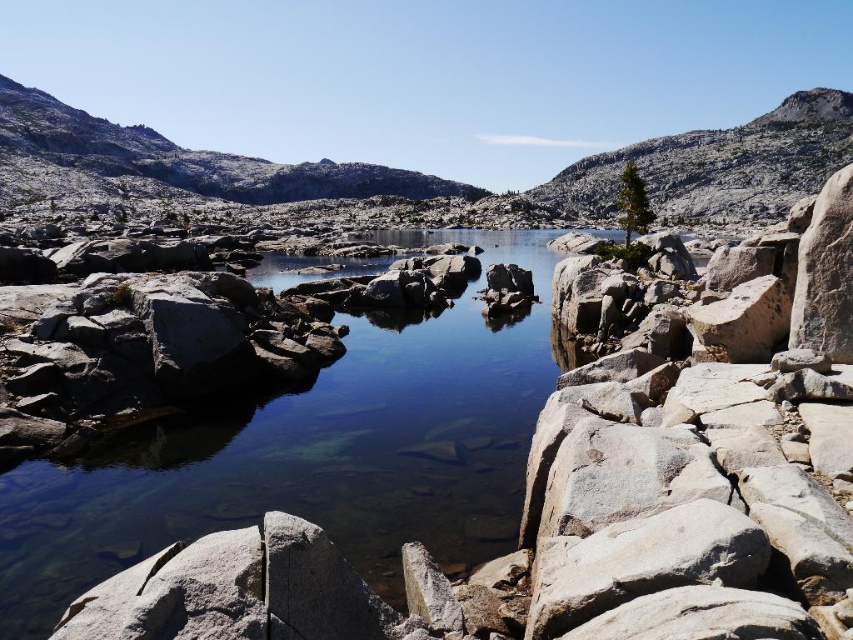
You are standing at the point with coordinates point (782,177) and want to see the point with coordinates point (543,188). Can you see it directly without moving?

Point (543,188) is behind point (782,177), so you cannot see it directly without moving.

You are a hiker planning to take a photo of the gray granite mountain at center and the gray granite mountain at upper right. Which mountain should you position closer to the camera to capture both in the same frame?

The gray granite mountain at upper right should be positioned closer to the camera because the gray granite mountain at center is located above it, so bringing the upper right mountain forward would allow both to be in the frame without one being obscured by the other.